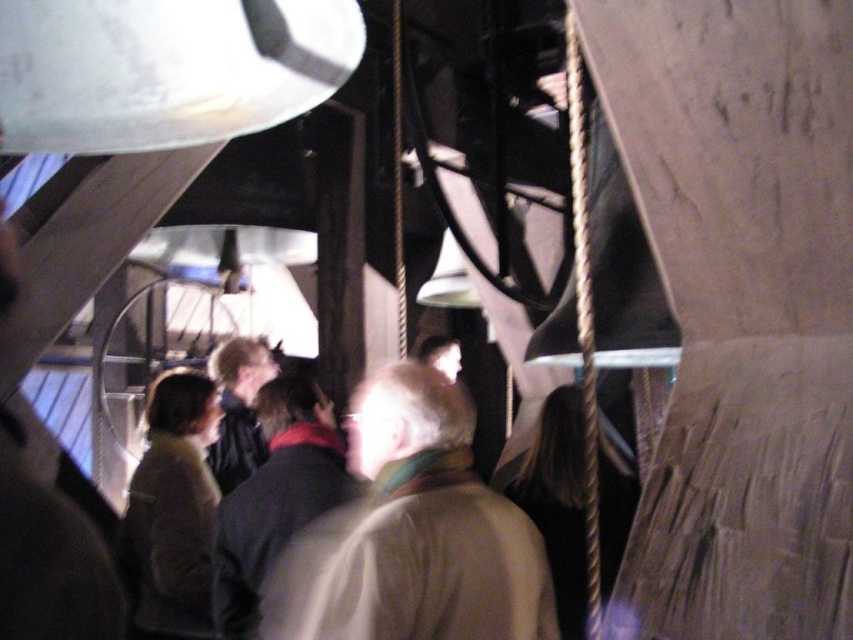
You are a security guard in the museum. You need to check if there is enough space between the light brown leather jacket at center and the gold metallic rope at right to walk through. The width of your body is 18 inches. Can you pass through the space between them?

The distance between the light brown leather jacket at center and the gold metallic rope at right is 17.41 inches, which is slightly narrower than your body width of 18 inches. Therefore, you cannot pass through the space between them comfortably.

You are a security guard in the museum and need to check both the light brown leather jacket at center and the gold metallic rope at right. Which object should you check first if you want to start with the one closer to your current position?

The light brown leather jacket at center should be checked first because it is in front of the gold metallic rope at right, meaning it is closer to your current position.

You are standing in the museum exhibit and see two points marked in the scene. The first point is at coordinate point (465,496) and the second is at point (584,186). If you were to walk towards the structure in the center, which point would you encounter first?

Point (584,186) would be encountered first because it is in front of point (465,496) according to their spatial arrangement.